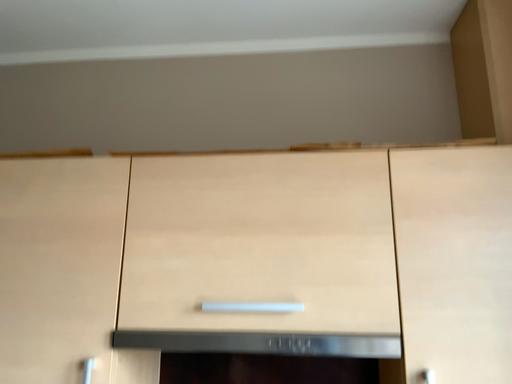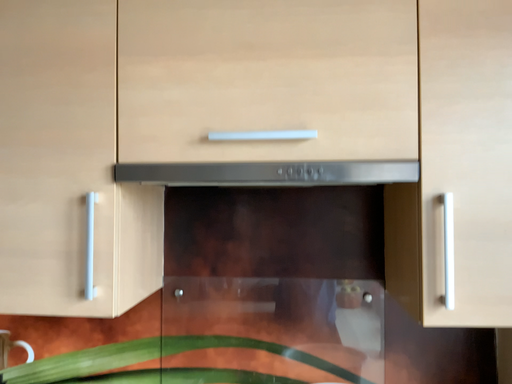
Question: Which way did the camera rotate in the video?

Choices:
 (A) rotated downward
 (B) rotated upward

Answer: (A)